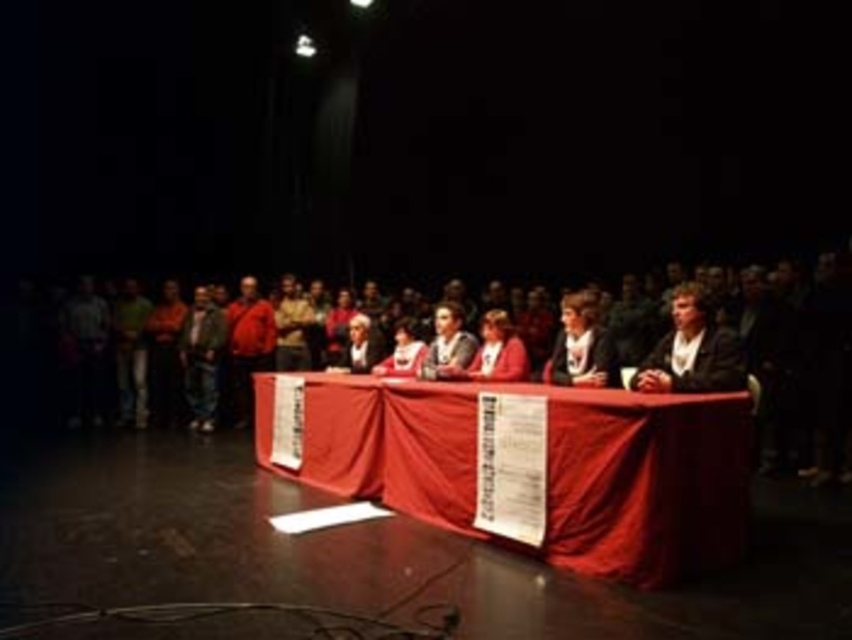
Where is `matte black crowd at center`? This screenshot has height=640, width=852. matte black crowd at center is located at coordinates (761, 348).

Which is in front, point (620, 368) or point (732, 404)?

Positioned in front is point (732, 404).

Identify the location of matte black crowd at center. (761, 348).